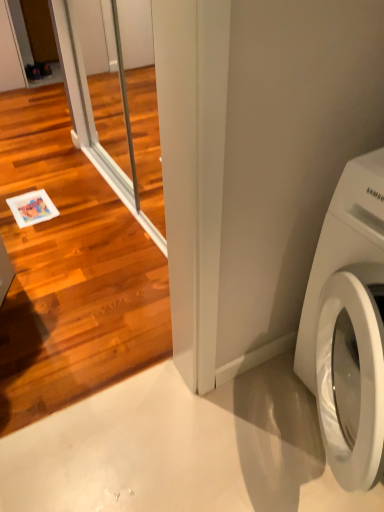
You are a GUI agent. You are given a task and a screenshot of the screen. Output one action in this format:
    pyautogui.click(x=<x>, y=<y>)
    Task: Click on the free space to the right of clear glass screen door at upper left, the 1th screen door positioned from the front
    
    Given the screenshot: What is the action you would take?
    [x=198, y=443]